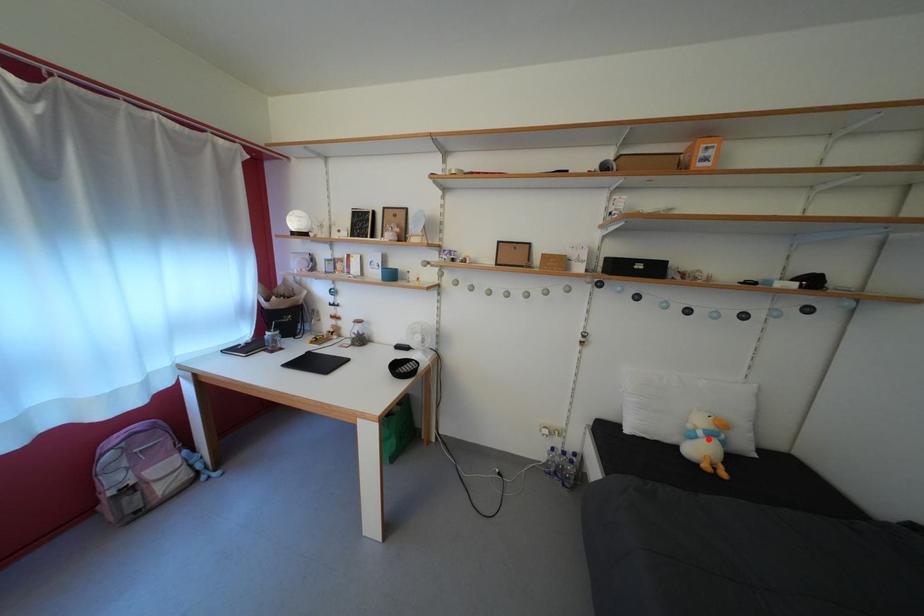
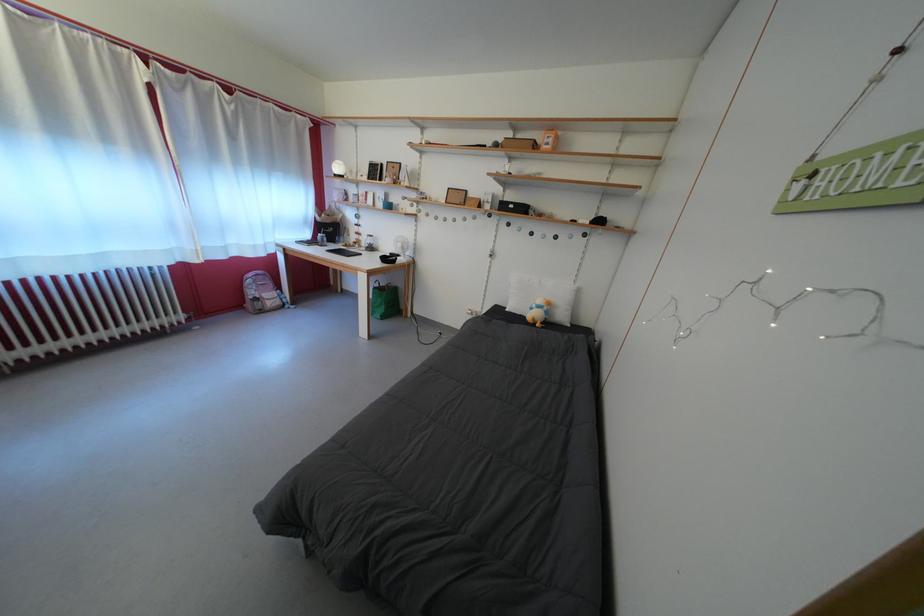
Locate, in the second image, the point that corresponds to the highlighted location in the first image.

(542, 312)